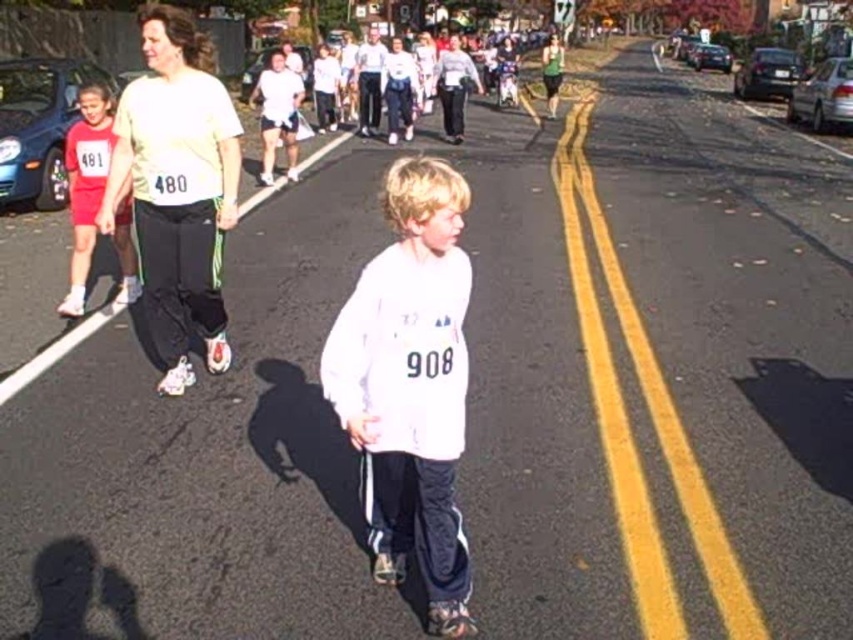
Based on the photo, between matte white shirt at left and matte red shorts at left, which one appears on the right side from the viewer's perspective?

matte white shirt at left is more to the right.

Is the position of matte white shirt at left more distant than that of matte red shorts at left?

No.

What do you see at coordinates (177, 188) in the screenshot? I see `matte white shirt at left` at bounding box center [177, 188].

Image resolution: width=853 pixels, height=640 pixels. What are the coordinates of `matte white shirt at left` in the screenshot? It's located at (177, 188).

Does white matte shirt at center appear over matte red shorts at left?

No, white matte shirt at center is not above matte red shorts at left.

Find the location of `white matte shirt at center`. white matte shirt at center is located at coordinates (410, 385).

This screenshot has width=853, height=640. What are the coordinates of `white matte shirt at center` in the screenshot? It's located at (410, 385).

How much distance is there between white matte shirt at center and matte white shirt at left?

A distance of 8.38 feet exists between white matte shirt at center and matte white shirt at left.

Who is lower down, white matte shirt at center or matte white shirt at left?

white matte shirt at center is below.

Is point (379, 330) positioned in front of point (160, 157)?

Yes, point (379, 330) is closer to viewer.

Locate an element on the screen. The width and height of the screenshot is (853, 640). white matte shirt at center is located at coordinates (410, 385).